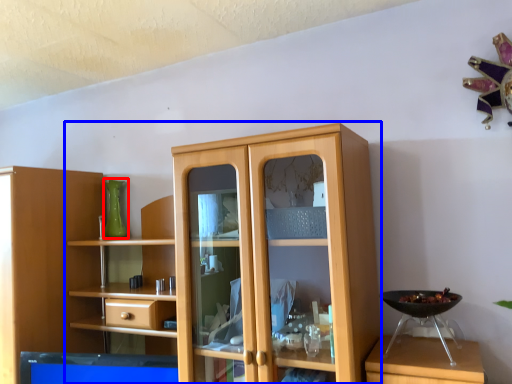
Question: Which point is closer to the camera, glass vase (highlighted by a red box) or cupboard (highlighted by a blue box)?

Choices:
 (A) glass vase
 (B) cupboard

Answer: (B)